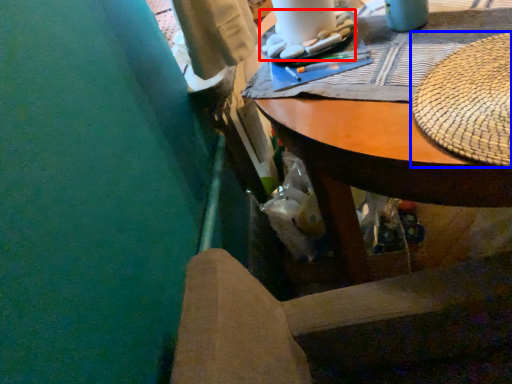
Question: Among these objects, which one is nearest to the camera, food (highlighted by a red box) or hat (highlighted by a blue box)?

Choices:
 (A) food
 (B) hat

Answer: (B)